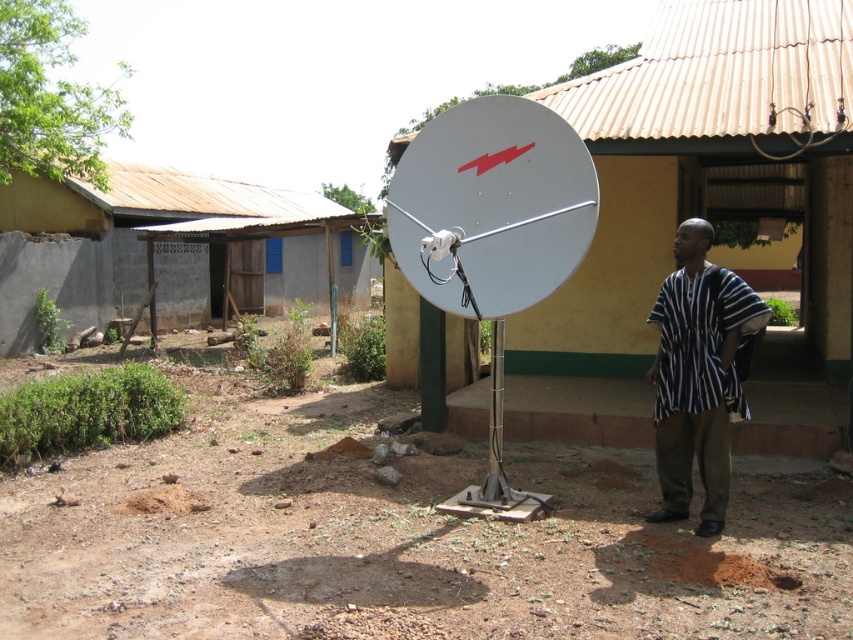
Question: Which point appears closest to the camera in this image?

Choices:
 (A) (331, 202)
 (B) (708, 323)
 (C) (831, 304)
 (D) (392, 243)

Answer: (B)

Question: Which object is positioned farthest from the white metallic satellite at center?

Choices:
 (A) gray concrete hut at center
 (B) striped fabric shirt at right
 (C) metallic satellite dish at center

Answer: (A)

Question: Is white metallic satellite at center wider than striped fabric shirt at right?

Choices:
 (A) no
 (B) yes

Answer: (B)

Question: In this image, where is brown soil at center located relative to metallic satellite dish at center?

Choices:
 (A) above
 (B) below

Answer: (B)

Question: Is gray concrete hut at center below striped fabric shirt at right?

Choices:
 (A) no
 (B) yes

Answer: (A)

Question: Which point is farther from the camera taking this photo?

Choices:
 (A) (659, 509)
 (B) (62, 209)
 (C) (643, 364)
 (D) (283, 515)

Answer: (B)